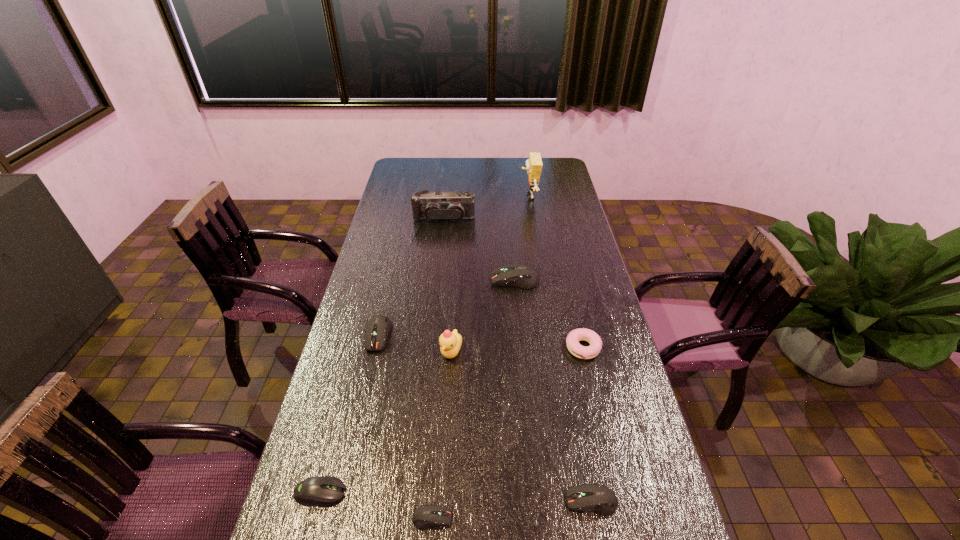
Identify the location of free region that satisfies the following two spatial constraints: 1. on the button of the third farthest object; 2. on the button of the leftmost dark computer equipment. The width and height of the screenshot is (960, 540). (520, 335).

This screenshot has height=540, width=960. Find the location of `free point that satisfies the following two spatial constraints: 1. on the front-facing side of the duckling; 2. on the button of the smallest dark computer equipment`. free point that satisfies the following two spatial constraints: 1. on the front-facing side of the duckling; 2. on the button of the smallest dark computer equipment is located at coordinates [441, 518].

Find the location of `vacant point that satisfies the following two spatial constraints: 1. on the button of the pink doughnut; 2. on the left side of the farthest dark computer equipment`. vacant point that satisfies the following two spatial constraints: 1. on the button of the pink doughnut; 2. on the left side of the farthest dark computer equipment is located at coordinates (521, 348).